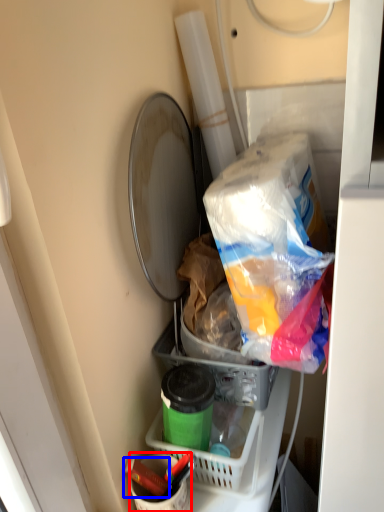
Question: Which object is further to the camera taking this photo, bucket (highlighted by a red box) or crayon (highlighted by a blue box)?

Choices:
 (A) bucket
 (B) crayon

Answer: (B)